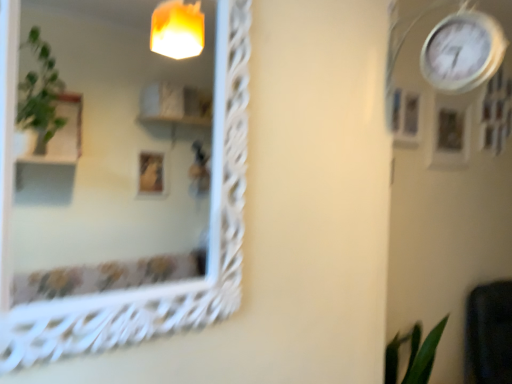
Question: Does wooden picture frame at upper right, the 1th picture frame when ordered from right to left, have a smaller size compared to matte white picture frame at upper right, marked as the 1th picture frame in a left-to-right arrangement?

Choices:
 (A) no
 (B) yes

Answer: (A)

Question: Considering the relative sizes of wooden picture frame at upper right, which is the first picture frame from back to front, and matte white picture frame at upper right, marked as the 1th picture frame in a left-to-right arrangement, in the image provided, is wooden picture frame at upper right, which is the first picture frame from back to front, wider than matte white picture frame at upper right, marked as the 1th picture frame in a left-to-right arrangement,?

Choices:
 (A) yes
 (B) no

Answer: (B)

Question: From the image's perspective, is wooden picture frame at upper right, the 2th picture frame positioned from the left, over matte white picture frame at upper right, marked as the 1th picture frame in a left-to-right arrangement?

Choices:
 (A) no
 (B) yes

Answer: (A)

Question: Considering the relative sizes of wooden picture frame at upper right, the 2th picture frame positioned from the left, and matte white picture frame at upper right, which is the first picture frame from front to back, in the image provided, is wooden picture frame at upper right, the 2th picture frame positioned from the left, bigger than matte white picture frame at upper right, which is the first picture frame from front to back,?

Choices:
 (A) yes
 (B) no

Answer: (A)

Question: Could matte white picture frame at upper right, marked as the 1th picture frame in a left-to-right arrangement, be considered to be inside wooden picture frame at upper right, the 2th picture frame positioned from the left?

Choices:
 (A) yes
 (B) no

Answer: (B)

Question: Is wooden picture frame at upper right, which appears as the second picture frame when viewed from the front, spatially inside white metallic clock at upper right, or outside of it?

Choices:
 (A) inside
 (B) outside

Answer: (B)

Question: Is point (437, 107) closer or farther from the camera than point (420, 52)?

Choices:
 (A) closer
 (B) farther

Answer: (B)

Question: In terms of size, does wooden picture frame at upper right, the 2th picture frame positioned from the left, appear bigger or smaller than white metallic clock at upper right?

Choices:
 (A) big
 (B) small

Answer: (B)

Question: Considering their positions, is wooden picture frame at upper right, the 1th picture frame when ordered from right to left, located in front of or behind white metallic clock at upper right?

Choices:
 (A) front
 (B) behind

Answer: (B)

Question: Considering the relative positions of matte white picture frame at upper right, acting as the second picture frame starting from the right, and white metallic clock at upper right in the image provided, is matte white picture frame at upper right, acting as the second picture frame starting from the right, to the left or to the right of white metallic clock at upper right?

Choices:
 (A) left
 (B) right

Answer: (B)

Question: From the image's perspective, is matte white picture frame at upper right, the second picture frame from the back, positioned above or below white metallic clock at upper right?

Choices:
 (A) below
 (B) above

Answer: (A)

Question: Is matte white picture frame at upper right, acting as the second picture frame starting from the right, in front of or behind white metallic clock at upper right in the image?

Choices:
 (A) behind
 (B) front

Answer: (A)

Question: From a real-world perspective, is matte white picture frame at upper right, acting as the second picture frame starting from the right, physically located above or below white metallic clock at upper right?

Choices:
 (A) below
 (B) above

Answer: (A)

Question: Is matte white picture frame at upper right, acting as the second picture frame starting from the right, in front of or behind white textured mirror at upper left in the image?

Choices:
 (A) behind
 (B) front

Answer: (A)

Question: In terms of width, does matte white picture frame at upper right, marked as the 1th picture frame in a left-to-right arrangement, look wider or thinner when compared to white textured mirror at upper left?

Choices:
 (A) thin
 (B) wide

Answer: (A)